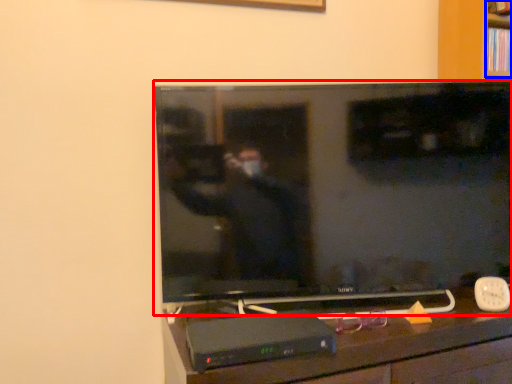
Question: Among these objects, which one is farthest to the camera, television (highlighted by a red box) or shelf (highlighted by a blue box)?

Choices:
 (A) television
 (B) shelf

Answer: (B)